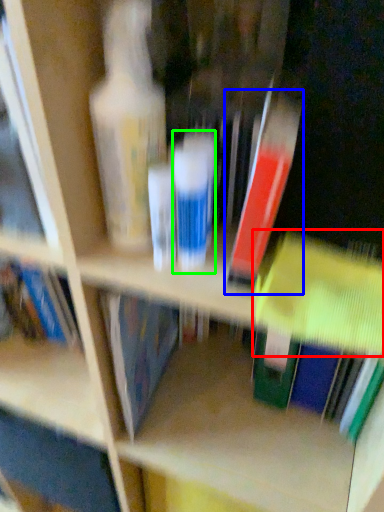
Question: Estimate the real-world distances between objects in this image. Which object is closer to book (highlighted by a red box), book (highlighted by a blue box) or toiletry (highlighted by a green box)?

Choices:
 (A) book
 (B) toiletry

Answer: (A)